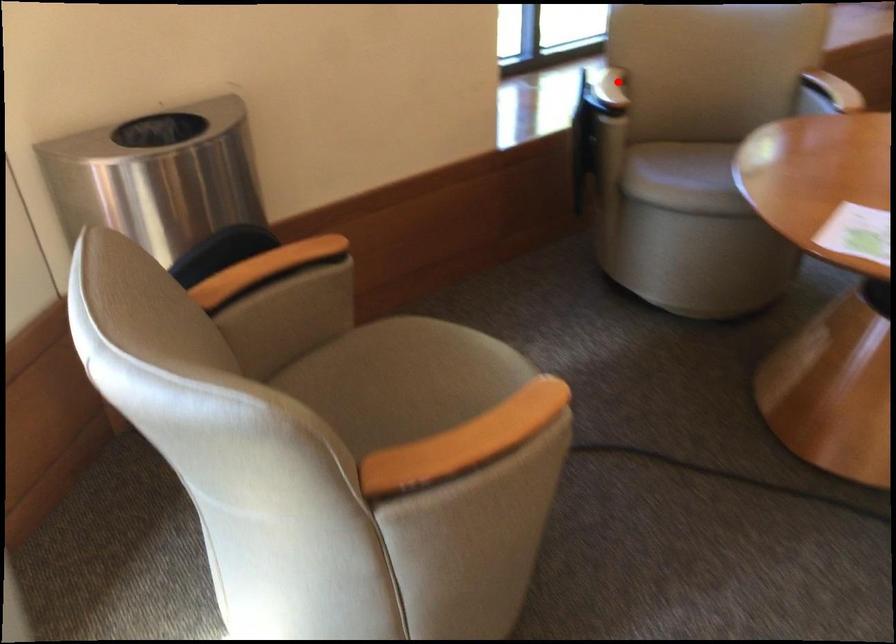
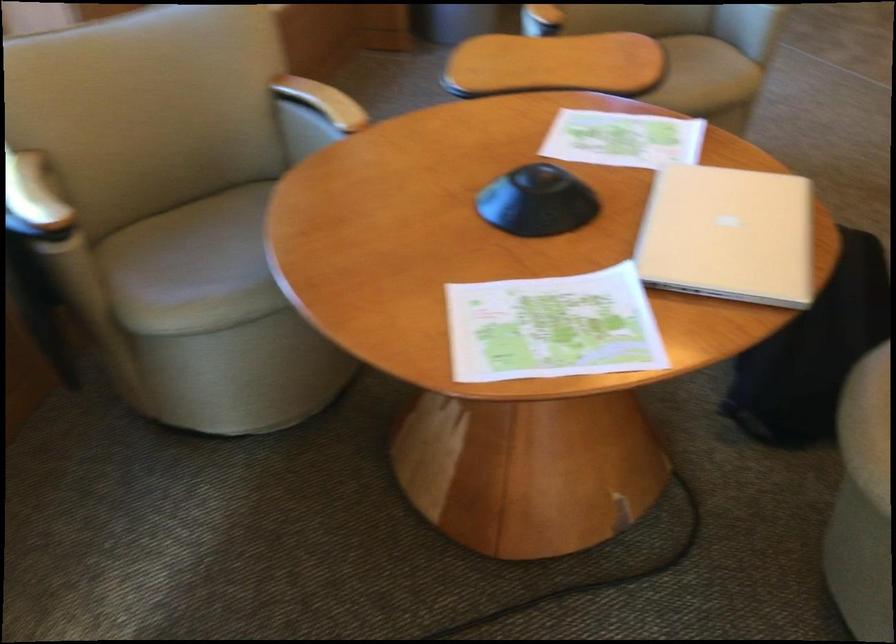
The point at the highlighted location is marked in the first image. Where is the corresponding point in the second image?

(33, 200)